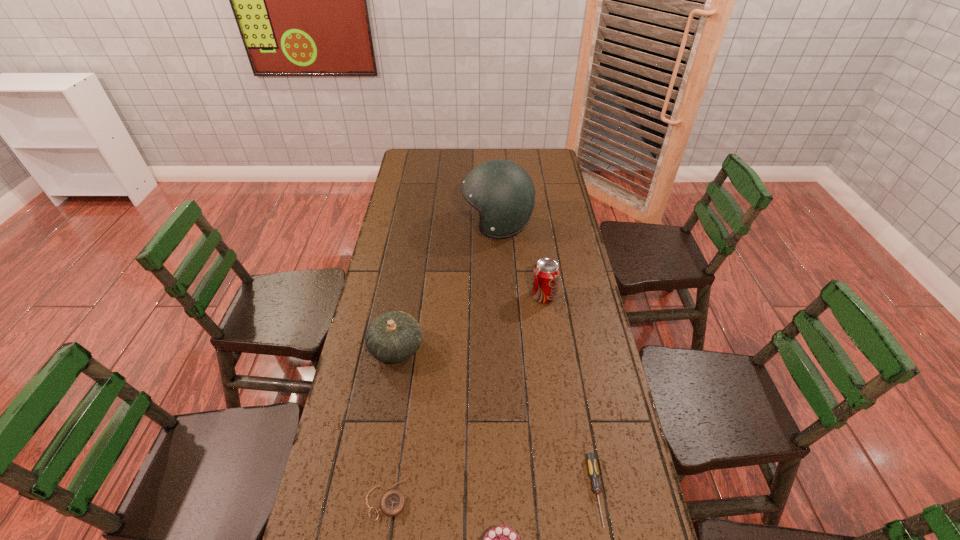
Identify the location of vacant space located 0.260m on the left of the fifth nearest object. (457, 296).

Where is `vacant region located on the right of the gourd`? The height and width of the screenshot is (540, 960). vacant region located on the right of the gourd is located at coordinates (462, 348).

Identify the location of vacant region located 0.340m on the right of the pocket watch. (548, 492).

What are the coordinates of `gourd at the left edge` in the screenshot? It's located at (394, 336).

You are a GUI agent. You are given a task and a screenshot of the screen. Output one action in this format:
    pyautogui.click(x=<x>, y=<y>)
    Task: Click on the pocket watch that is at the left edge
    The height and width of the screenshot is (540, 960).
    Given the screenshot: What is the action you would take?
    pyautogui.click(x=392, y=503)

Identify the location of soda can positioned at the right edge. (546, 273).

Image resolution: width=960 pixels, height=540 pixels. I want to click on screwdriver at the right edge, so point(591,457).

This screenshot has width=960, height=540. Find the location of `free space at the far edge of the desktop`. free space at the far edge of the desktop is located at coordinates (441, 151).

In the image, there is a desktop. Where is `vacant space at the left edge`? vacant space at the left edge is located at coordinates (392, 228).

The image size is (960, 540). Find the location of `free space at the far right corner of the desktop`. free space at the far right corner of the desktop is located at coordinates (556, 153).